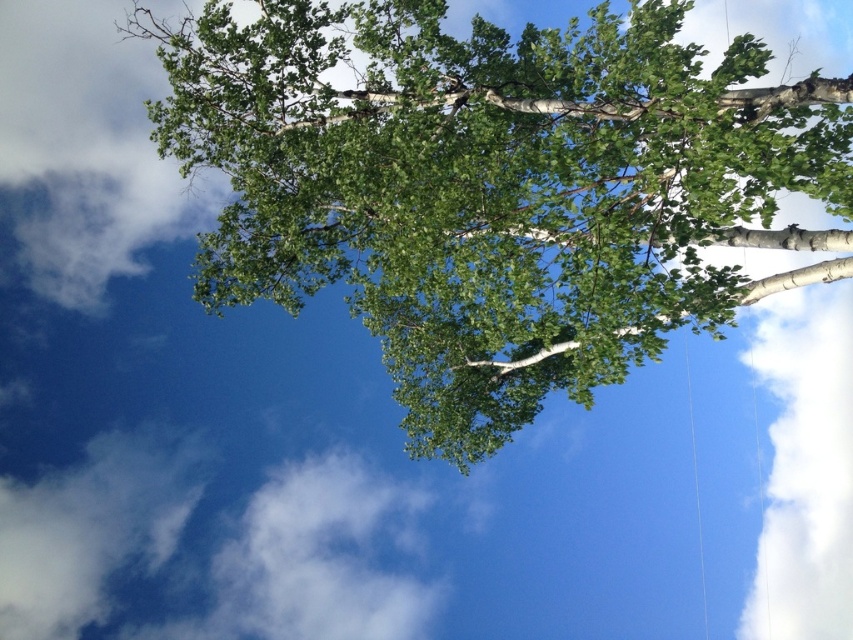
Consider the image. You are an artist painting the scene. You want to ensure the green leafy tree at upper center and the white fluffy cloud at lower left are proportionally accurate. Which object should you paint larger?

The green leafy tree at upper center should be painted larger since it is larger compared to the white fluffy cloud at lower left according to the description.

You are standing in front of a tree with a dense canopy of green leaves. You want to locate the white fluffy cloud at upper right. Where exactly is it positioned relative to the tree?

The white fluffy cloud at upper right is positioned at point coordinates of 0.733 on the x axis and 0.945 on the y axis relative to the tree.